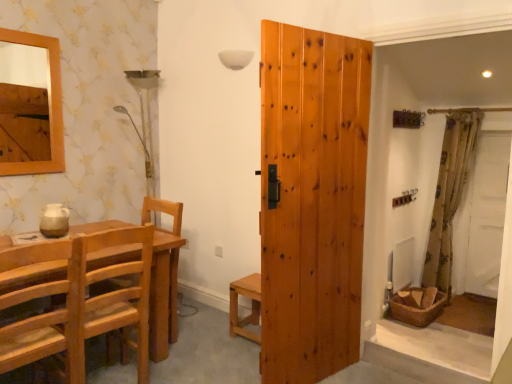
Locate an element on the screen. This screenshot has width=512, height=384. vacant space to the right of natural wood chair at left is located at coordinates (188, 343).